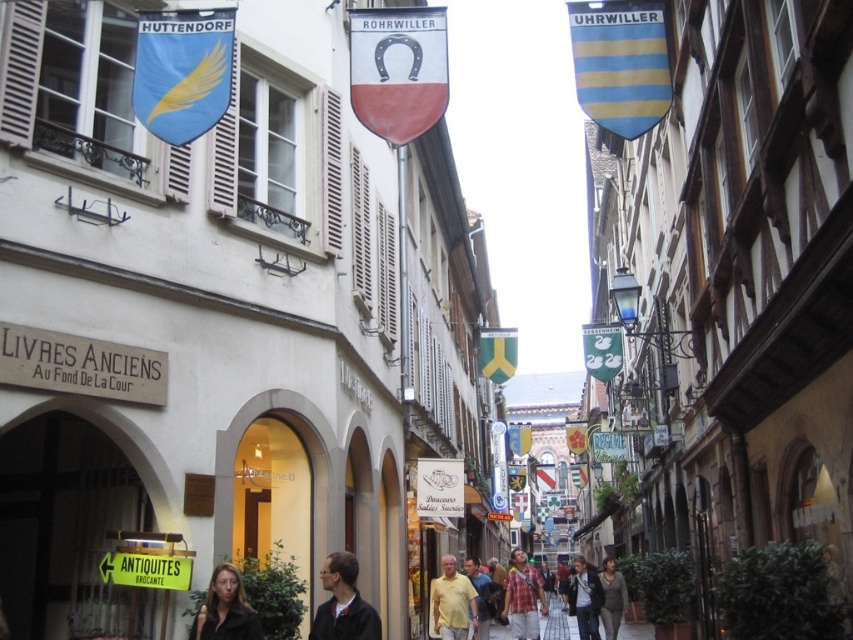
You are a tourist walking down the street and see both the dark gray jacket at center and the matte black jacket at lower center. Which jacket is positioned lower in the scene?

The dark gray jacket at center is located below the matte black jacket at lower center, so it is positioned lower in the scene.

You are a window dresser who needs to replace the blue fabric flag with golden feather at upper left and the matte black jacket at lower center with items of the same size. Which object requires a wider replacement?

The matte black jacket at lower center requires a wider replacement since the blue fabric flag with golden feather at upper left has a lesser width compared to matte black jacket at lower center.